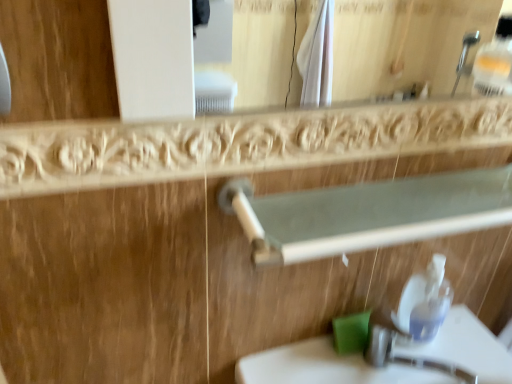
The height and width of the screenshot is (384, 512). I want to click on vacant space to the right of transparent plastic soap dispenser at lower right, so click(x=466, y=345).